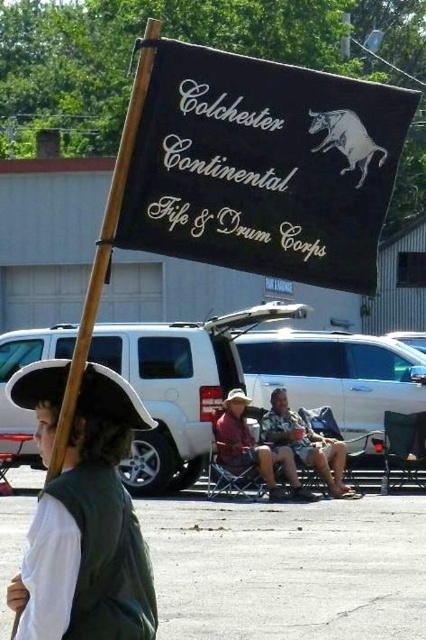
Can you confirm if white matte hat at left is smaller than wooden pole at upper left?

Correct, white matte hat at left occupies less space than wooden pole at upper left.

Image resolution: width=426 pixels, height=640 pixels. Describe the element at coordinates (89, 531) in the screenshot. I see `white matte hat at left` at that location.

Identify the location of white matte hat at left. This screenshot has width=426, height=640. (89, 531).

Is wooden pole at upper left above camouflage fabric shorts at center?

Indeed, wooden pole at upper left is positioned over camouflage fabric shorts at center.

Is point (118, 189) farther from viewer compared to point (325, 470)?

That is False.

Between point (108, 200) and point (314, 468), which one is positioned in front?

Point (314, 468)

This screenshot has height=640, width=426. What are the coordinates of `wooden pole at upper left` in the screenshot? It's located at (104, 243).

Does black fabric sign at upper center appear on the right side of wooden pole at upper left?

Yes, black fabric sign at upper center is to the right of wooden pole at upper left.

Does black fabric sign at upper center appear over wooden pole at upper left?

Incorrect, black fabric sign at upper center is not positioned above wooden pole at upper left.

The height and width of the screenshot is (640, 426). What do you see at coordinates (261, 164) in the screenshot?
I see `black fabric sign at upper center` at bounding box center [261, 164].

At what (x,y) coordinates should I click in order to perform the action: click on black fabric sign at upper center. Please return your answer as a coordinate pair (x, y). The height and width of the screenshot is (640, 426). Looking at the image, I should click on (261, 164).